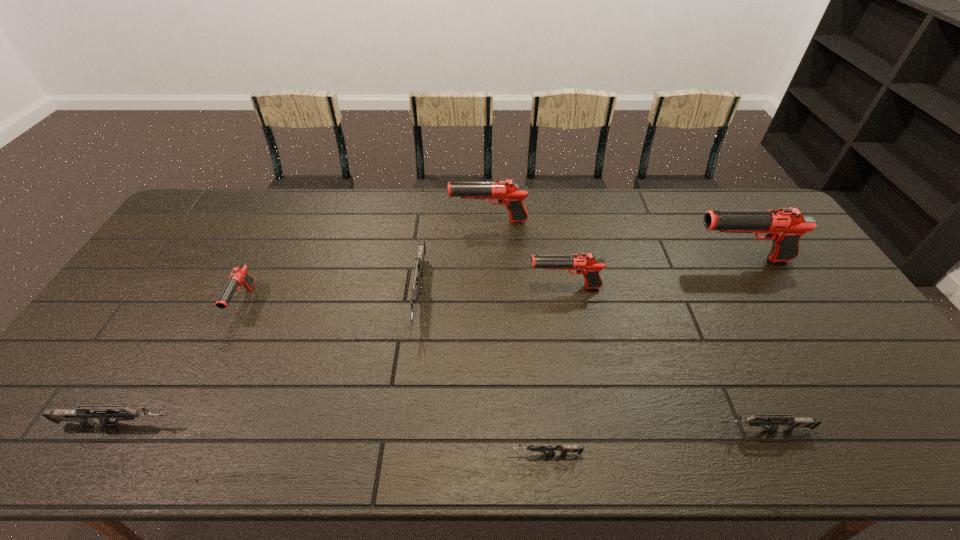
You are a GUI agent. You are given a task and a screenshot of the screen. Output one action in this format:
    pyautogui.click(x=<x>, y=<y>)
    Task: Click on the third shortest gun
    The height and width of the screenshot is (540, 960).
    Given the screenshot: What is the action you would take?
    pyautogui.click(x=82, y=414)

At what (x,y) coordinates should I click in order to perform the action: click on the seventh tallest object. Please return your answer as a coordinate pair (x, y). Looking at the image, I should click on tap(790, 422).

In order to click on the second smallest grey gun in this screenshot , I will do `click(790, 422)`.

The image size is (960, 540). Identify the location of the smallest grey gun. (539, 447).

The width and height of the screenshot is (960, 540). In order to click on the nearest grey gun in this screenshot , I will do `click(539, 447)`.

Find the location of a particular element. This screenshot has height=540, width=960. vacant space located at the aiming end of the rightmost black gun is located at coordinates (617, 260).

Identify the location of free spot located 0.320m at the aiming end of the rightmost black gun. (589, 260).

The image size is (960, 540). In order to click on free region located at the aiming end of the rightmost black gun in this screenshot , I will do `click(620, 260)`.

At what (x,y) coordinates should I click in order to perform the action: click on vacant space located 0.050m at the aiming end of the farthest object. Please return your answer as a coordinate pair (x, y). This screenshot has width=960, height=540. Looking at the image, I should click on (436, 221).

Find the location of a particular element. The height and width of the screenshot is (540, 960). blank area located 0.250m at the aiming end of the farthest object is located at coordinates (378, 221).